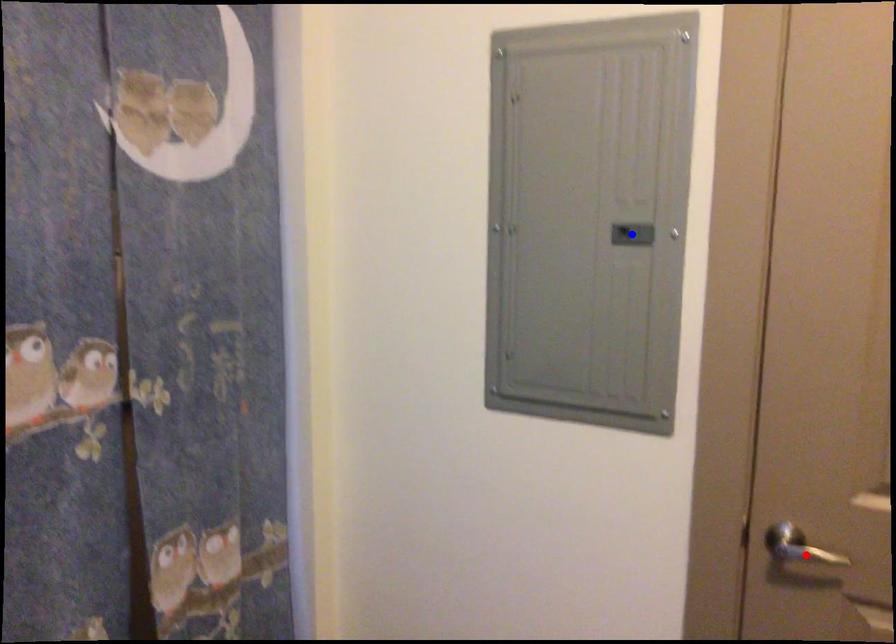
Question: Two points are marked on the image. Which point is closer to the camera?

Choices:
 (A) Blue point is closer.
 (B) Red point is closer.

Answer: (B)